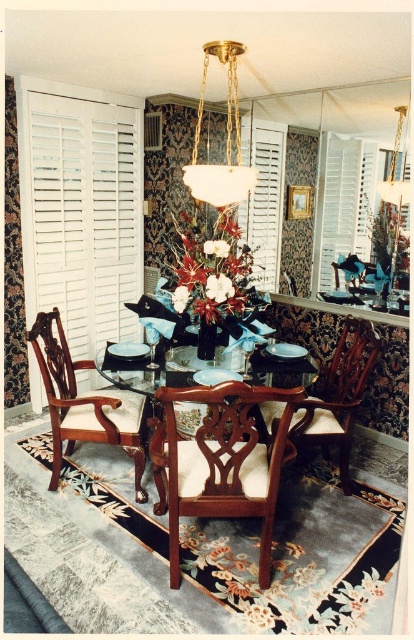
Question: Which object is closer to the camera taking this photo?

Choices:
 (A) wooden chair at center
 (B) white wood shutter at left
 (C) mahogany wood chair at center

Answer: (C)

Question: From the image, what is the correct spatial relationship of mahogany wood chair at center in relation to white matte shutter at upper center?

Choices:
 (A) right
 (B) left

Answer: (B)

Question: Can you confirm if white wood shutter at upper center is smaller than white glass chandelier at center?

Choices:
 (A) yes
 (B) no

Answer: (A)

Question: Which point is farther from the camera taking this photo?

Choices:
 (A) (332, 221)
 (B) (190, 332)
 (C) (252, 163)
 (D) (250, 496)

Answer: (C)

Question: Does white wood shutter at left have a lesser width compared to wooden chair at center?

Choices:
 (A) yes
 (B) no

Answer: (A)

Question: Considering the real-world distances, which object is farthest from the wooden chair at center?

Choices:
 (A) white wood shutter at upper center
 (B) mahogany wood table at center
 (C) white glass chandelier at center
 (D) mahogany wood chair at left

Answer: (C)